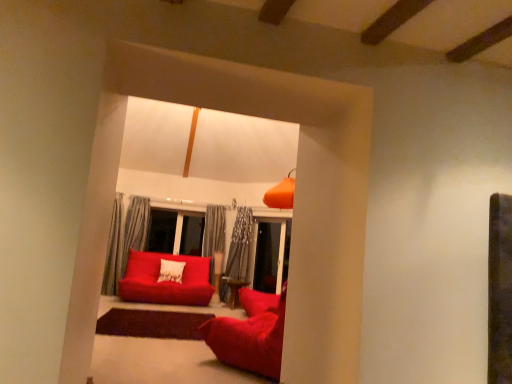
Question: From a real-world perspective, is velvet red beanbag at center, arranged as the 1th studio couch when viewed from the right, located beneath matte red studio couch at center, the second studio couch viewed from the front?

Choices:
 (A) yes
 (B) no

Answer: (A)

Question: Is velvet red beanbag at center, arranged as the 2th studio couch when viewed from the back, taller than matte red studio couch at center, the second studio couch viewed from the front?

Choices:
 (A) no
 (B) yes

Answer: (A)

Question: From the image's perspective, does velvet red beanbag at center, arranged as the 2th studio couch when viewed from the back, appear lower than matte red studio couch at center, which appears as the 1th studio couch when viewed from the left?

Choices:
 (A) yes
 (B) no

Answer: (B)

Question: Does velvet red beanbag at center, arranged as the 2th studio couch when viewed from the back, have a lesser height compared to matte red studio couch at center, the second studio couch viewed from the front?

Choices:
 (A) no
 (B) yes

Answer: (B)

Question: Considering the relative positions of velvet red beanbag at center, arranged as the 2th studio couch when viewed from the back, and matte red studio couch at center, placed as the 2th studio couch when sorted from right to left, in the image provided, is velvet red beanbag at center, arranged as the 2th studio couch when viewed from the back, to the left of matte red studio couch at center, placed as the 2th studio couch when sorted from right to left, from the viewer's perspective?

Choices:
 (A) no
 (B) yes

Answer: (A)

Question: Are velvet red beanbag at center, acting as the first studio couch starting from the front, and matte red studio couch at center, which appears as the 1th studio couch when viewed from the left, far apart?

Choices:
 (A) no
 (B) yes

Answer: (B)

Question: From a real-world perspective, is matte red studio couch at center, arranged as the first studio couch when viewed from the back, on top of velvet red beanbag at center, which ranks as the 2th studio couch in left-to-right order?

Choices:
 (A) yes
 (B) no

Answer: (A)

Question: Considering the relative sizes of matte red studio couch at center, the second studio couch viewed from the front, and velvet red beanbag at center, arranged as the 2th studio couch when viewed from the back, in the image provided, is matte red studio couch at center, the second studio couch viewed from the front, smaller than velvet red beanbag at center, arranged as the 2th studio couch when viewed from the back,?

Choices:
 (A) yes
 (B) no

Answer: (B)

Question: Is matte red studio couch at center, placed as the 2th studio couch when sorted from right to left, to the left of velvet red beanbag at center, arranged as the 1th studio couch when viewed from the right, from the viewer's perspective?

Choices:
 (A) no
 (B) yes

Answer: (B)

Question: Does matte red studio couch at center, arranged as the first studio couch when viewed from the back, have a greater width compared to velvet red beanbag at center, arranged as the 2th studio couch when viewed from the back?

Choices:
 (A) yes
 (B) no

Answer: (A)

Question: Is matte red studio couch at center, which appears as the 1th studio couch when viewed from the left, oriented towards velvet red beanbag at center, which ranks as the 2th studio couch in left-to-right order?

Choices:
 (A) yes
 (B) no

Answer: (A)

Question: Would you consider matte red studio couch at center, the second studio couch viewed from the front, to be distant from velvet red beanbag at center, which ranks as the 2th studio couch in left-to-right order?

Choices:
 (A) no
 (B) yes

Answer: (B)

Question: Is matte red studio couch at center, arranged as the first studio couch when viewed from the back, inside or outside of velvet red beanbag at center, acting as the first studio couch starting from the front?

Choices:
 (A) inside
 (B) outside

Answer: (B)